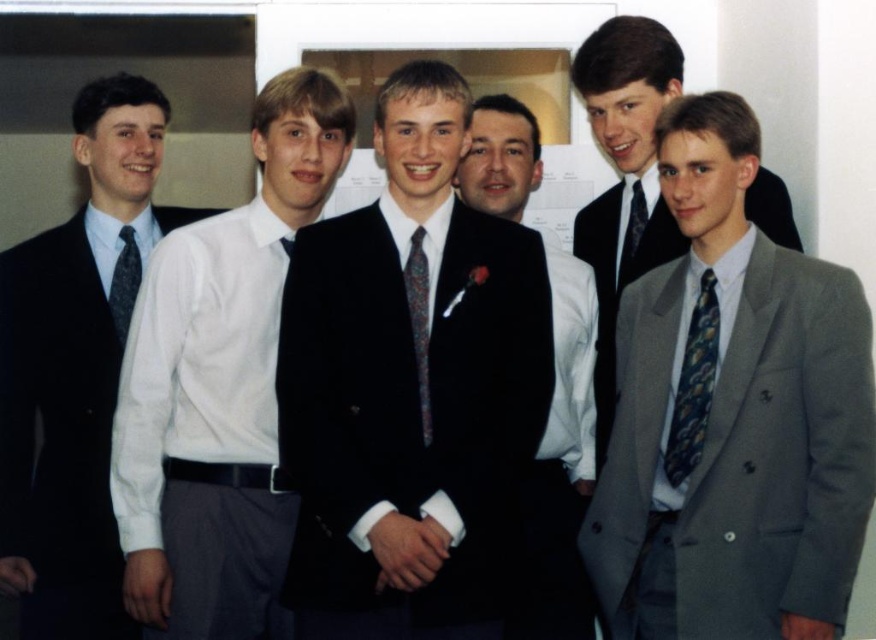
Can you confirm if shiny black suit at center is shorter than dark blue textured tie at center?

No, shiny black suit at center is not shorter than dark blue textured tie at center.

Between shiny black suit at center and dark blue textured tie at center, which one appears on the right side from the viewer's perspective?

From the viewer's perspective, dark blue textured tie at center appears more on the right side.

Based on the photo, who is more distant from viewer, (295, 429) or (627, 230)?

Point (627, 230)

Identify the location of shiny black suit at center. (408, 390).

Is the position of matte black suit at left less distant than that of dark blue patterned tie at center?

No, it is behind dark blue patterned tie at center.

Between matte black suit at left and dark blue patterned tie at center, which one appears on the left side from the viewer's perspective?

Positioned to the left is matte black suit at left.

Which is in front, point (34, 442) or point (413, 344)?

Point (413, 344) is more forward.

The image size is (876, 640). Identify the location of matte black suit at left. (74, 371).

Who is more distant from viewer, [513,163] or [684,417]?

Point [513,163]

Which is behind, point (591, 598) or point (672, 417)?

The point (591, 598) is behind.

Locate an element on the screen. black velvet suit at center is located at coordinates (560, 467).